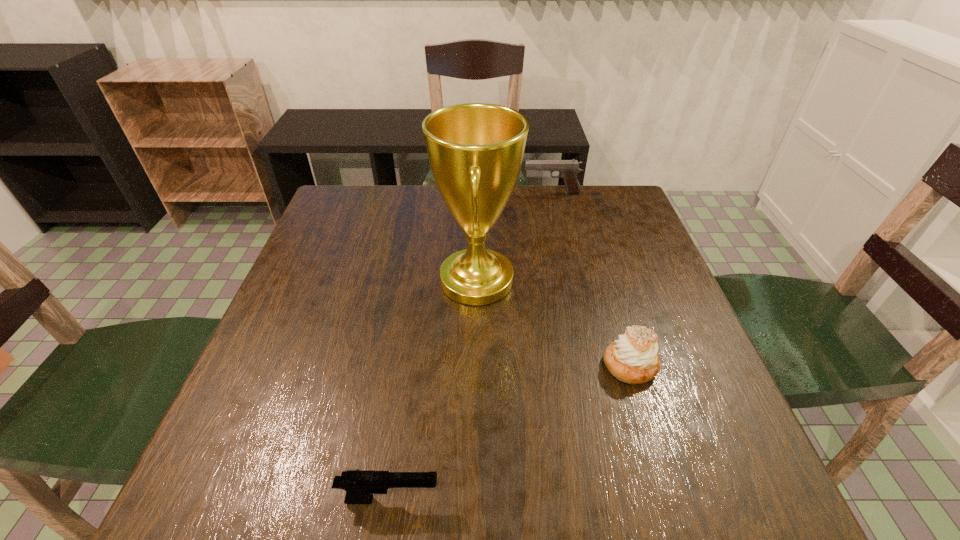
Where is `vacant space located 0.140m at the barrel of the third shortest object`? vacant space located 0.140m at the barrel of the third shortest object is located at coordinates (478, 193).

At what (x,y) coordinates should I click in order to perform the action: click on free spot located on the front of the pastry. Please return your answer as a coordinate pair (x, y). Looking at the image, I should click on (649, 426).

This screenshot has width=960, height=540. I want to click on vacant region located on the front-facing side of the left pistol, so click(x=664, y=500).

Where is `object that is positioned at the far edge`? The image size is (960, 540). object that is positioned at the far edge is located at coordinates (568, 169).

In order to click on object located at the near edge in this screenshot , I will do `click(360, 486)`.

Where is `pistol present at the right edge`? The height and width of the screenshot is (540, 960). pistol present at the right edge is located at coordinates (568, 169).

The height and width of the screenshot is (540, 960). Identify the location of pastry positioned at the right edge. (633, 358).

This screenshot has width=960, height=540. Identify the location of object located at the far right corner. (568, 169).

Identify the location of vacant area at the far edge. (551, 210).

In the image, there is a desktop. What are the coordinates of `vacant space at the left edge` in the screenshot? It's located at (334, 330).